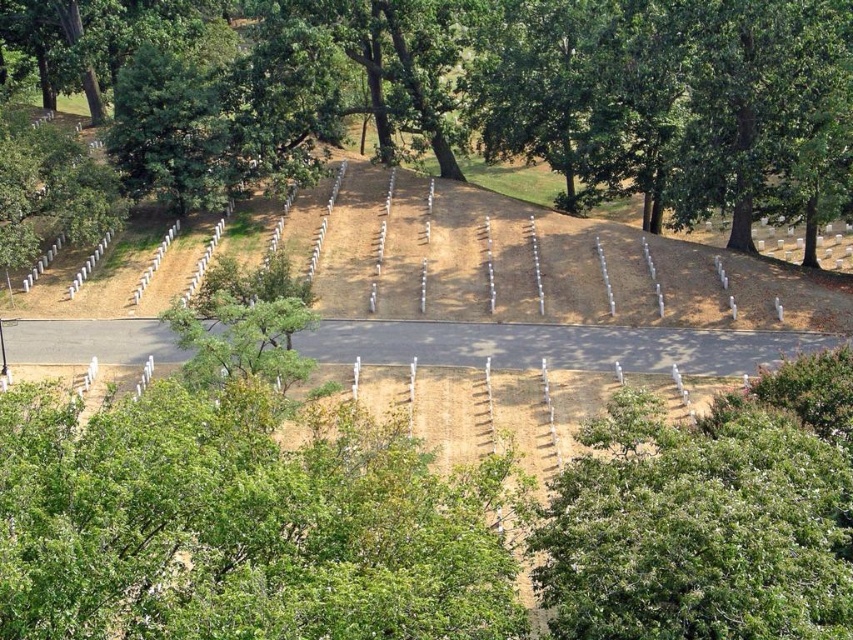
You are standing at the viewpoint of the image, and you want to visit the point marked at coordinates [131,32]. If your walking speed is 1.5 meters per second, how many seconds will it take you to reach that point?

The distance between you and the point marked at coordinates [131,32] is 88.54 meters. At a walking speed of 1.5 meters per second, it will take approximately 59 seconds to reach the point.

You are standing at the center of the cemetery and want to walk towards the green leafy tree at center. Which direction should you go?

The green leafy tree at center is located at point (532, 86), so you should walk towards the direction of the coordinates to reach it.

Looking at this image, you are standing at the edge of a cemetery and want to take a photo of the white wooden markers at center without any obstruction. Since there is a green leafy tree at center in the way, which object should you move to ensure the markers are visible?

The white wooden markers at center are behind the green leafy tree at center. To take a photo of the white wooden markers at center without obstruction, you should move around or behind the green leafy tree at center so that the markers come into view.